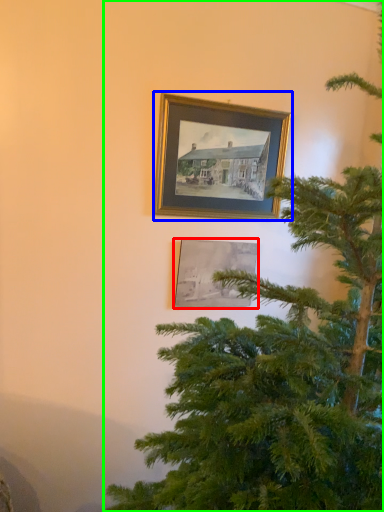
Question: Which is nearer to the picture frame (highlighted by a red box)? picture frame (highlighted by a blue box) or christmas tree (highlighted by a green box).

Choices:
 (A) picture frame
 (B) christmas tree

Answer: (A)